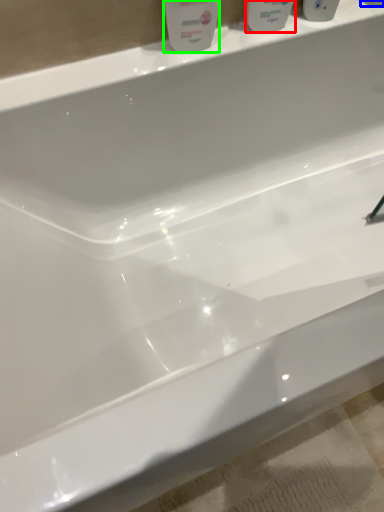
Question: Which object is the farthest from mouthwash (highlighted by a red box)? Choose among these: mouthwash (highlighted by a blue box) or cleaning product (highlighted by a green box).

Choices:
 (A) mouthwash
 (B) cleaning product

Answer: (A)